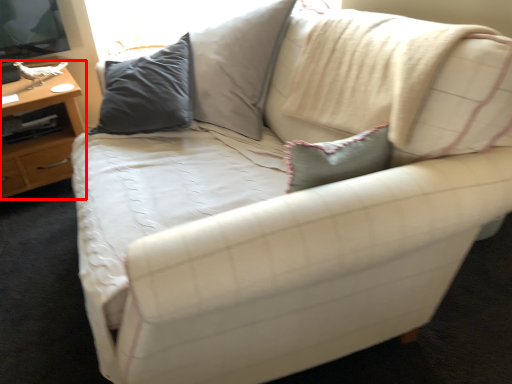
Question: From the image's perspective, what is the correct spatial positioning of table (annotated by the red box) in reference to pillow?

Choices:
 (A) below
 (B) above

Answer: (A)